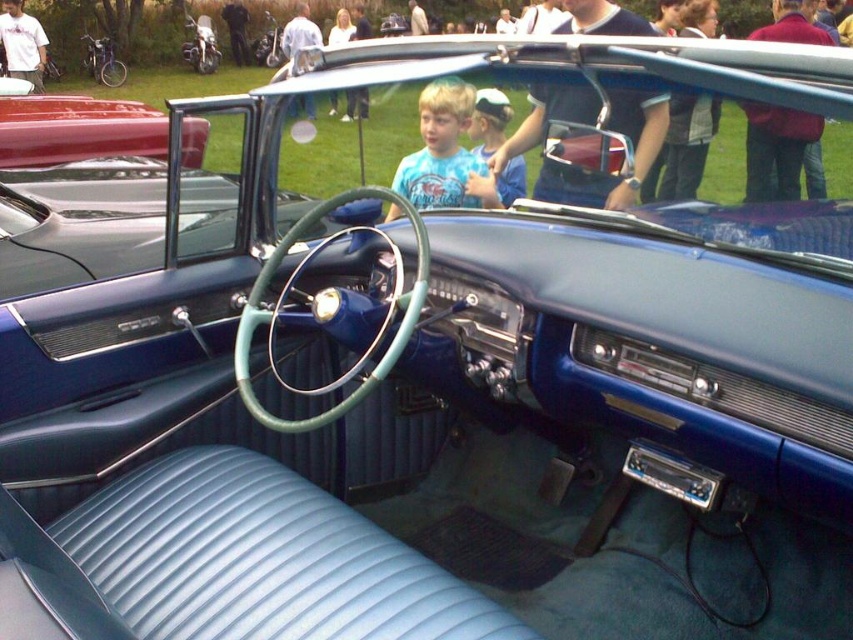
Question: Which point appears closest to the camera in this image?

Choices:
 (A) (480, 152)
 (B) (405, 156)

Answer: (A)

Question: Can you confirm if blue cotton shirt at center is wider than blue leather cap at upper center?

Choices:
 (A) no
 (B) yes

Answer: (B)

Question: Is blue cotton shirt at center wider than blue leather cap at upper center?

Choices:
 (A) yes
 (B) no

Answer: (A)

Question: Is the position of blue leather dashboard at center more distant than that of blue leather cap at upper center?

Choices:
 (A) no
 (B) yes

Answer: (A)

Question: Which point is closer to the camera taking this photo?

Choices:
 (A) (236, 470)
 (B) (433, 122)

Answer: (A)

Question: Which of the following is the farthest from the observer?

Choices:
 (A) blue cotton shirt at center
 (B) blue leather dashboard at center
 (C) blue leather cap at upper center

Answer: (A)